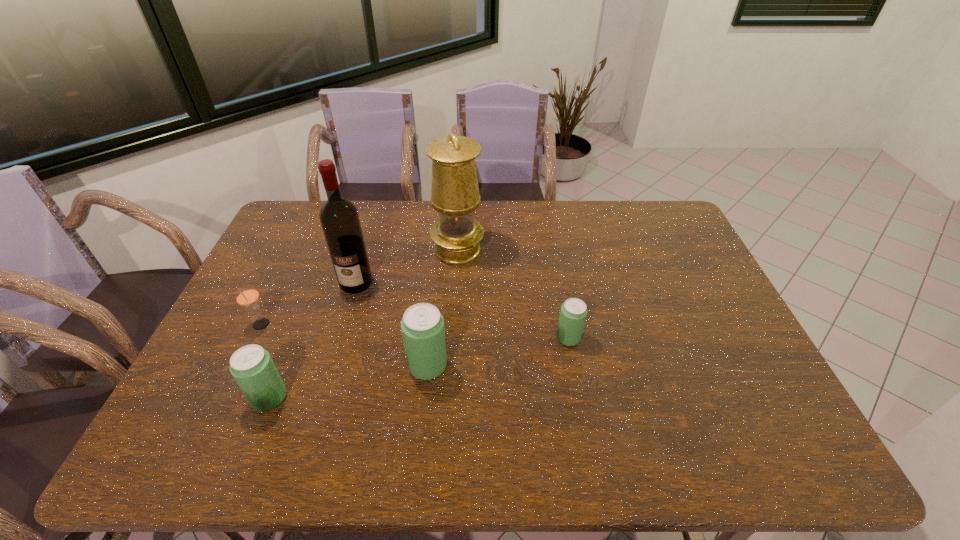
Identify the location of the second object from left to right. The height and width of the screenshot is (540, 960). point(253,369).

Where is `the second tallest soda`? This screenshot has width=960, height=540. the second tallest soda is located at coordinates (253, 369).

Find the location of a particular element. The image size is (960, 540). the second soda from right to left is located at coordinates (422, 325).

Find the location of a particular element. The width and height of the screenshot is (960, 540). the farthest soda is located at coordinates (573, 314).

At what (x,y) coordinates should I click in order to perform the action: click on the shortest soda. Please return your answer as a coordinate pair (x, y). Image resolution: width=960 pixels, height=540 pixels. Looking at the image, I should click on (573, 314).

Where is `oil lamp`? The image size is (960, 540). oil lamp is located at coordinates (455, 195).

This screenshot has width=960, height=540. Find the location of `alcohol`. alcohol is located at coordinates (339, 218).

Image resolution: width=960 pixels, height=540 pixels. I want to click on the fifth nearest object, so click(x=339, y=218).

Locate an element on the screen. straw is located at coordinates (247, 296).

The width and height of the screenshot is (960, 540). I want to click on vacant space located 0.050m on the back of the fifth object from right to left, so click(x=282, y=366).